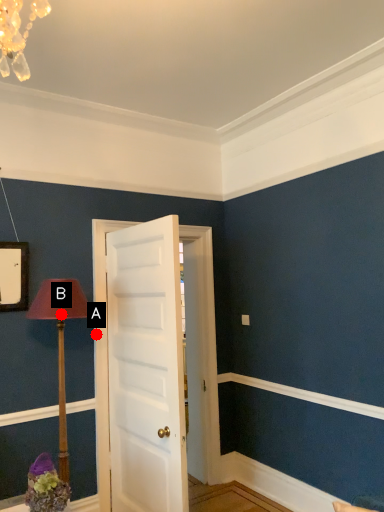
Question: Two points are circled on the image, labeled by A and B beside each circle. Which of the following is the farthest from the observer?

Choices:
 (A) A is further
 (B) B is further

Answer: (A)